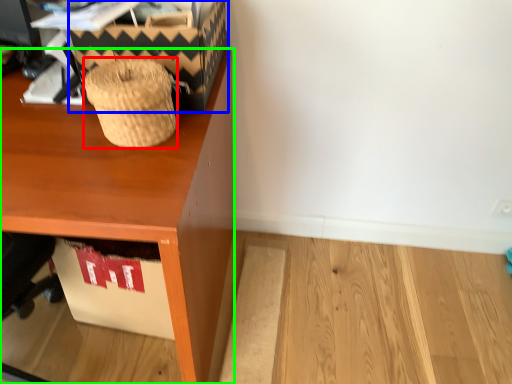
Question: Which object is the closest to the basket (highlighted by a red box)? Choose among these: shoe box (highlighted by a blue box) or desk (highlighted by a green box).

Choices:
 (A) shoe box
 (B) desk

Answer: (A)